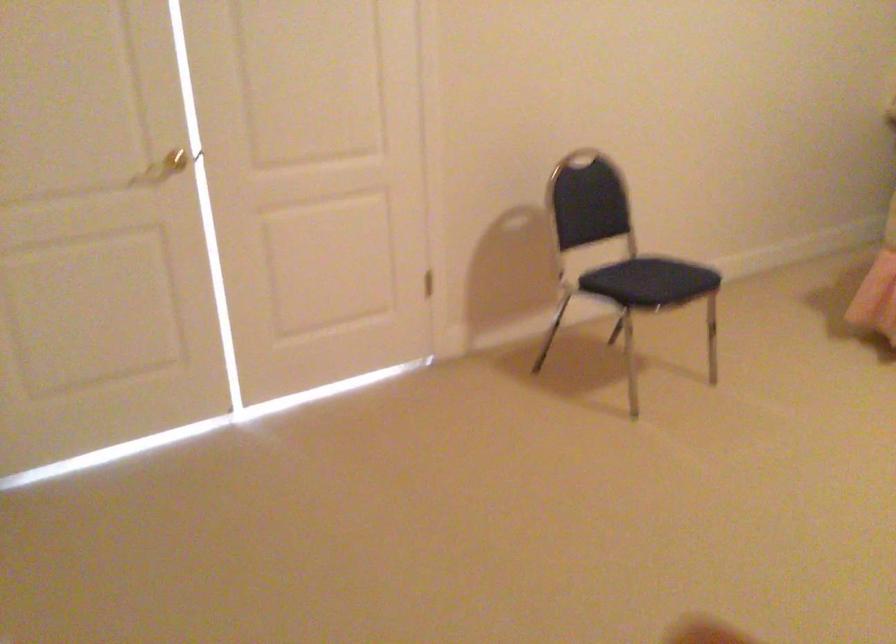
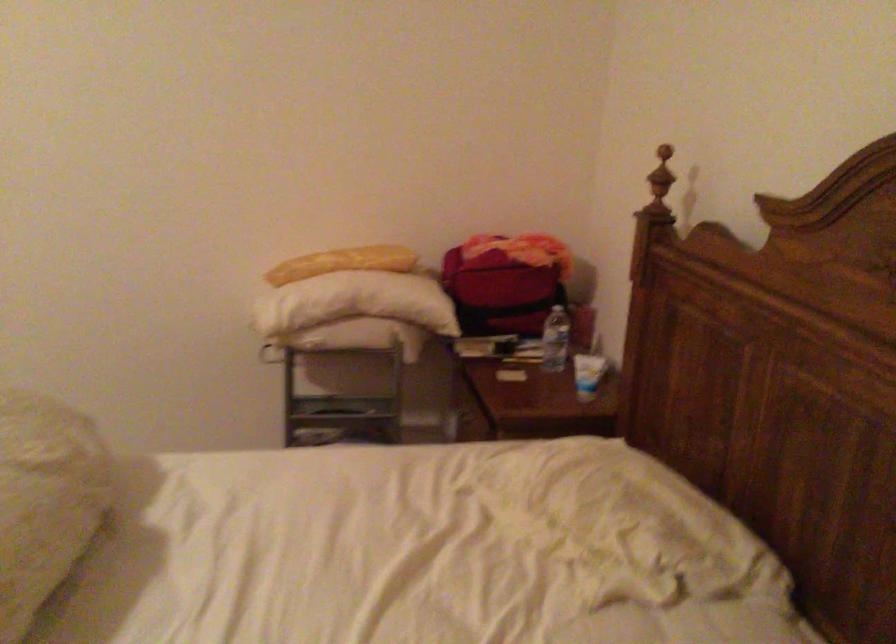
Which direction would the cameraman need to move to produce the second image?

The movement direction of the cameraman is right, forward.